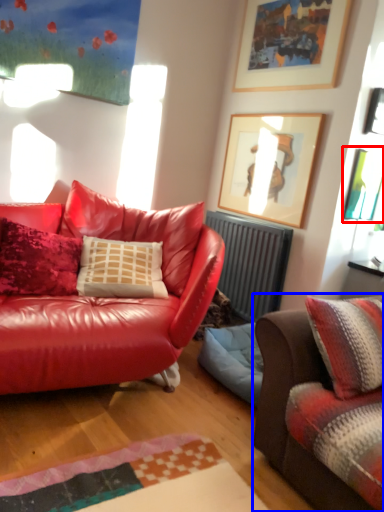
Question: Which object is further to the camera taking this photo, picture frame (highlighted by a red box) or studio couch (highlighted by a blue box)?

Choices:
 (A) picture frame
 (B) studio couch

Answer: (A)